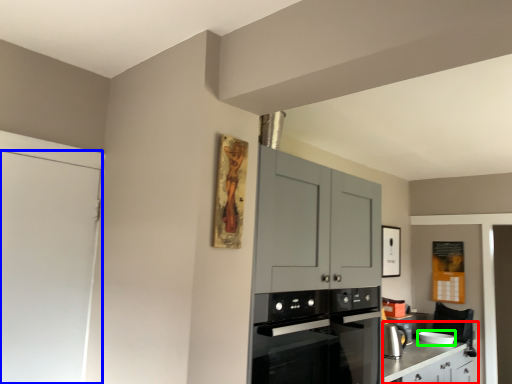
Question: Estimate the real-world distances between objects in this image. Which object is closer to counter (highlighted by a red box), door (highlighted by a blue box) or appliance (highlighted by a green box)?

Choices:
 (A) door
 (B) appliance

Answer: (B)